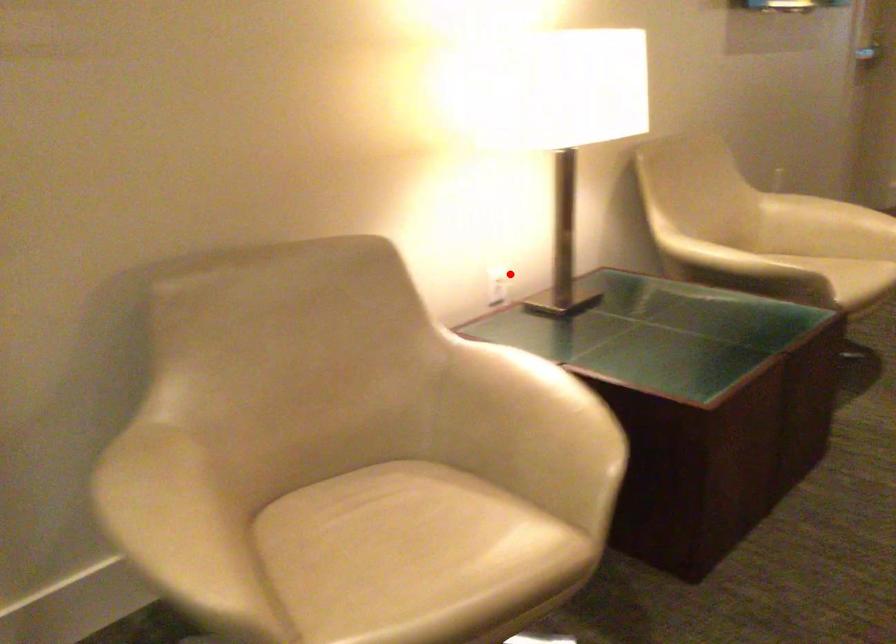
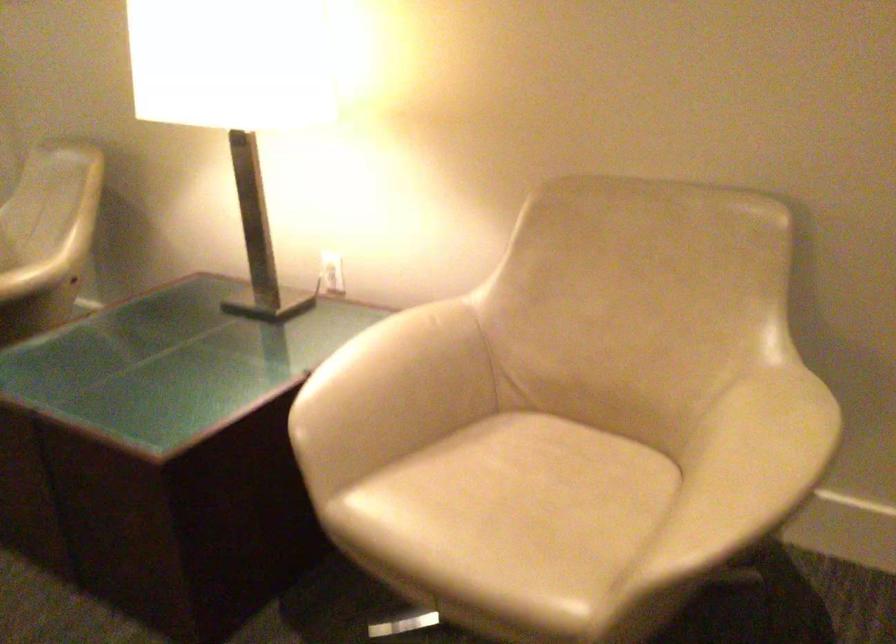
Question: A red point is marked in image1. In image2, is the corresponding 3D point closer to the camera or farther? Reply with the corresponding letter.

Choices:
 (A) The corresponding 3D point is closer.
 (B) The corresponding 3D point is farther.

Answer: (A)